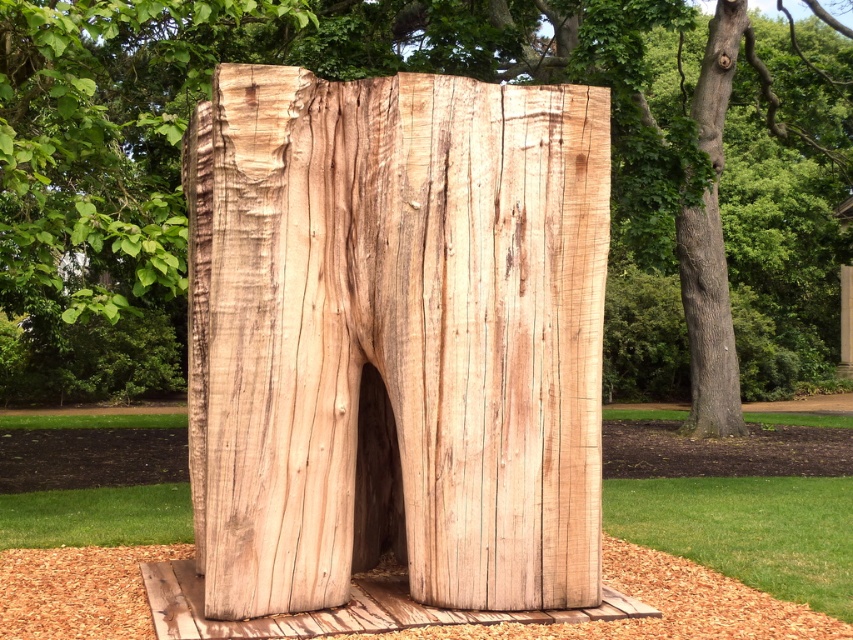
Can you confirm if natural wood sculpture at center is positioned to the right of natural wood tree trunk at right?

In fact, natural wood sculpture at center is to the left of natural wood tree trunk at right.

Describe the element at coordinates (395, 339) in the screenshot. I see `natural wood sculpture at center` at that location.

Which is in front, point (204, 532) or point (701, 84)?

Positioned in front is point (204, 532).

At what (x,y) coordinates should I click in order to perform the action: click on natural wood sculpture at center. Please return your answer as a coordinate pair (x, y). The height and width of the screenshot is (640, 853). Looking at the image, I should click on (395, 339).

Can you confirm if natural wood sculpture at center is thinner than natural wood tree trunk at center?

Correct, natural wood sculpture at center's width is less than natural wood tree trunk at center's.

Which is in front, point (585, 582) or point (138, 252)?

Positioned in front is point (585, 582).

At what (x,y) coordinates should I click in order to perform the action: click on natural wood sculpture at center. Please return your answer as a coordinate pair (x, y). The width and height of the screenshot is (853, 640). Looking at the image, I should click on (395, 339).

Can you confirm if natural wood tree trunk at center is positioned above natural wood tree trunk at right?

Indeed, natural wood tree trunk at center is positioned over natural wood tree trunk at right.

Does natural wood tree trunk at center have a lesser width compared to natural wood tree trunk at right?

No, natural wood tree trunk at center is not thinner than natural wood tree trunk at right.

Which is behind, point (683, 118) or point (723, 116)?

Point (723, 116)

This screenshot has height=640, width=853. I want to click on natural wood tree trunk at center, so click(x=447, y=74).